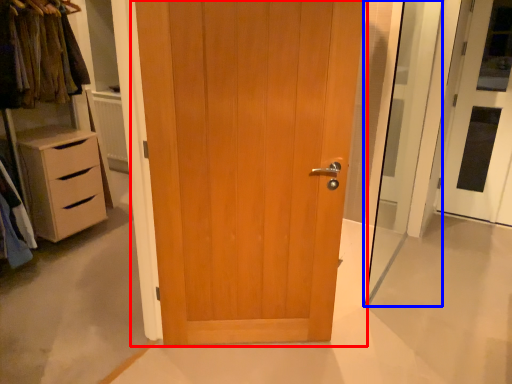
Question: Which object is closer to the camera taking this photo, door (highlighted by a red box) or screen door (highlighted by a blue box)?

Choices:
 (A) door
 (B) screen door

Answer: (A)